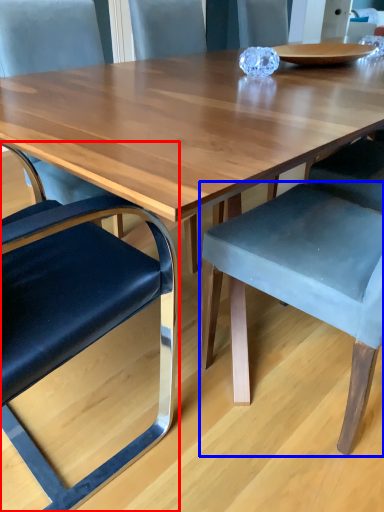
Question: Which object appears farthest to the camera in this image, chair (highlighted by a red box) or chair (highlighted by a blue box)?

Choices:
 (A) chair
 (B) chair

Answer: (B)